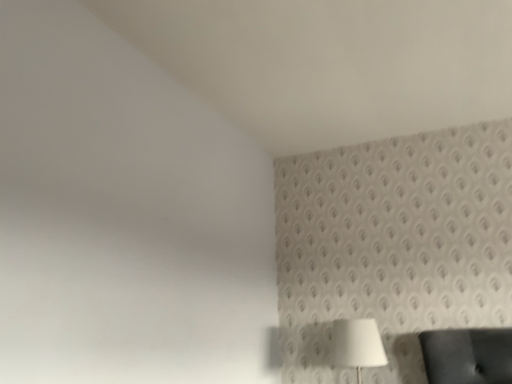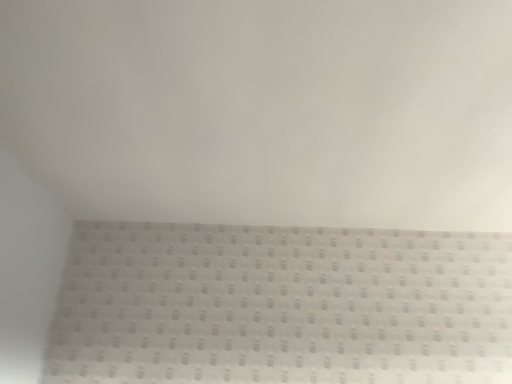
Question: How did the camera likely rotate when shooting the video?

Choices:
 (A) rotated left
 (B) rotated right

Answer: (B)